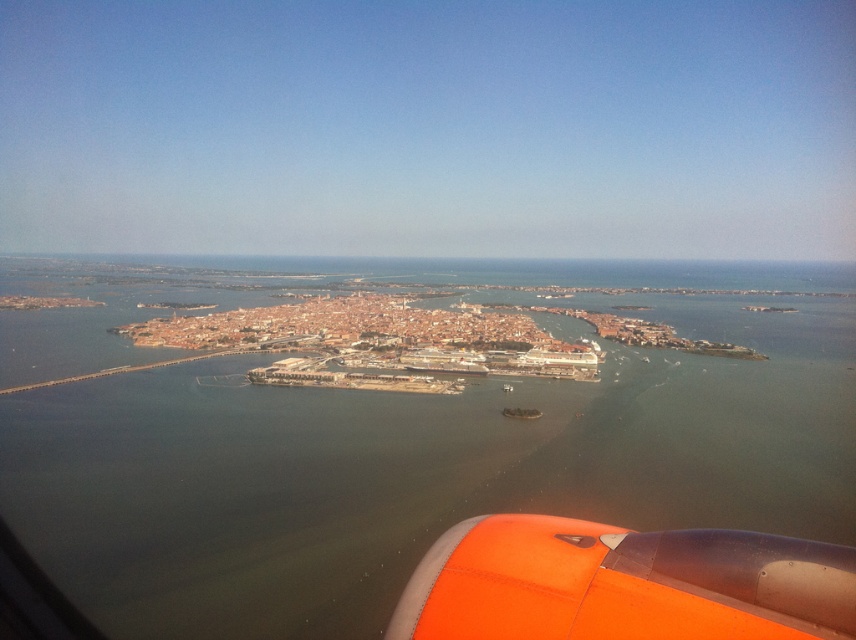
Question: Where is brown water at center located in relation to orange matte engine at lower right in the image?

Choices:
 (A) below
 (B) above

Answer: (B)

Question: Considering the relative positions of brown water at center and orange matte engine at lower right in the image provided, where is brown water at center located with respect to orange matte engine at lower right?

Choices:
 (A) above
 (B) below

Answer: (A)

Question: Which point is farther to the camera?

Choices:
 (A) (821, 268)
 (B) (730, 550)

Answer: (A)

Question: Which of these objects is positioned farthest from the metallic silver boat at center?

Choices:
 (A) orange matte engine at lower right
 (B) brown water at center

Answer: (B)

Question: Which point appears closest to the camera in this image?

Choices:
 (A) (149, 604)
 (B) (530, 419)

Answer: (A)

Question: Is brown water at center in front of metallic silver boat at center?

Choices:
 (A) yes
 (B) no

Answer: (A)